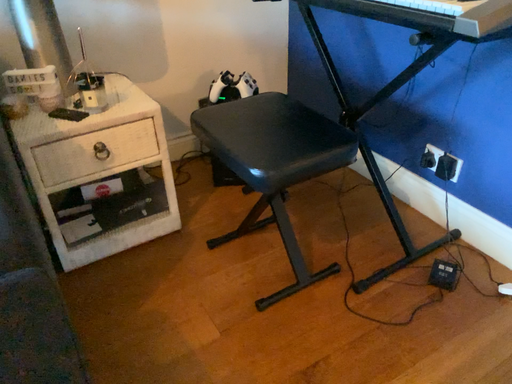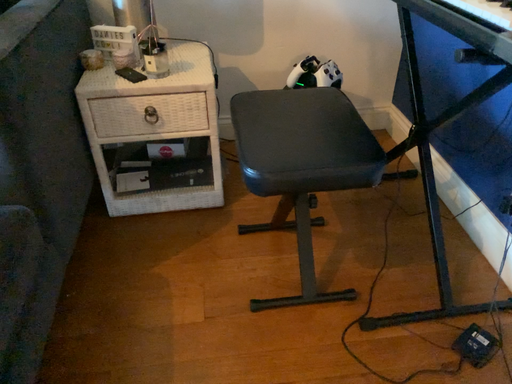
Question: Which way did the camera rotate in the video?

Choices:
 (A) rotated right
 (B) rotated left

Answer: (B)